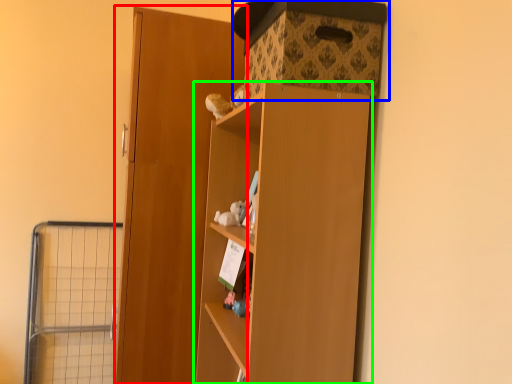
Question: Considering the real-world distances, which object is closest to door (highlighted by a red box)? storage box (highlighted by a blue box) or cupboard (highlighted by a green box).

Choices:
 (A) storage box
 (B) cupboard

Answer: (A)